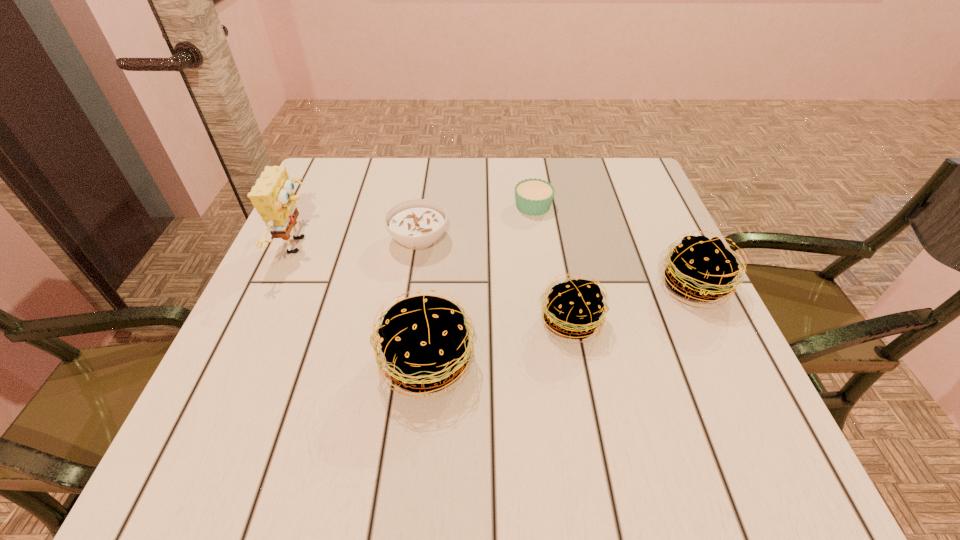
Find the location of a particular element. This screenshot has height=540, width=960. free space that satisfies the following two spatial constraints: 1. on the face of the rightmost patty; 2. on the right side of the sponge is located at coordinates [281, 286].

Where is `free space that satisfies the following two spatial constraints: 1. on the front side of the rightmost patty; 2. on the right side of the soup bowl`? This screenshot has height=540, width=960. free space that satisfies the following two spatial constraints: 1. on the front side of the rightmost patty; 2. on the right side of the soup bowl is located at coordinates (412, 286).

This screenshot has height=540, width=960. Identify the location of vacant region that satisfies the following two spatial constraints: 1. on the face of the second patty from left to right; 2. on the right side of the leftmost object. (266, 321).

The height and width of the screenshot is (540, 960). I want to click on free space in the image that satisfies the following two spatial constraints: 1. on the back side of the shortest object; 2. on the left side of the soup bowl, so pyautogui.click(x=424, y=206).